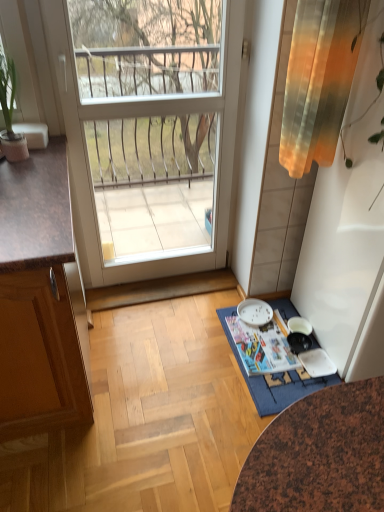
Identify the location of free space above white glossy plate at lower center (from a real-world perspective). The height and width of the screenshot is (512, 384). (256, 313).